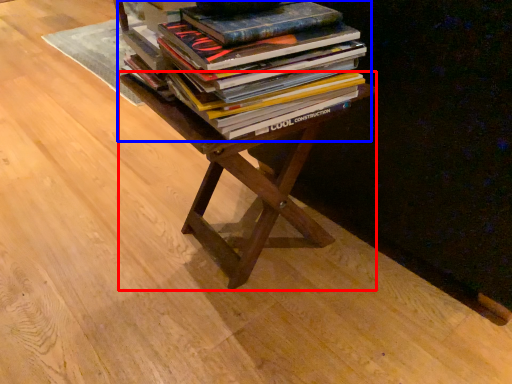
Question: Which of the following is the closest to the observer, table (highlighted by a red box) or book (highlighted by a blue box)?

Choices:
 (A) table
 (B) book

Answer: (B)